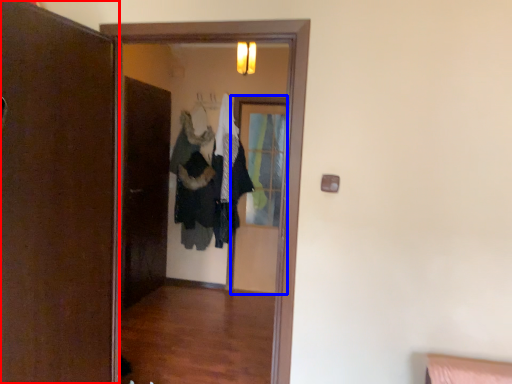
Question: Which of the following is the closest to the observer, door (highlighted by a red box) or screen door (highlighted by a blue box)?

Choices:
 (A) door
 (B) screen door

Answer: (A)